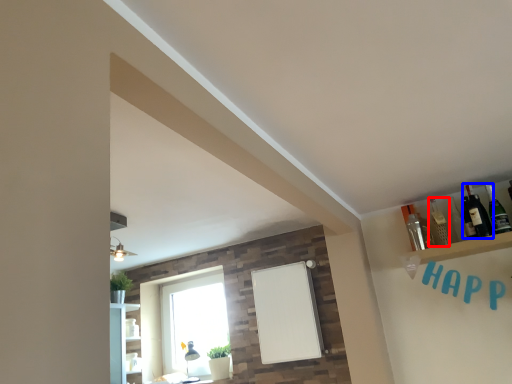
Question: Which object is further to the camera taking this photo, bottle (highlighted by a red box) or bottle (highlighted by a blue box)?

Choices:
 (A) bottle
 (B) bottle

Answer: (A)